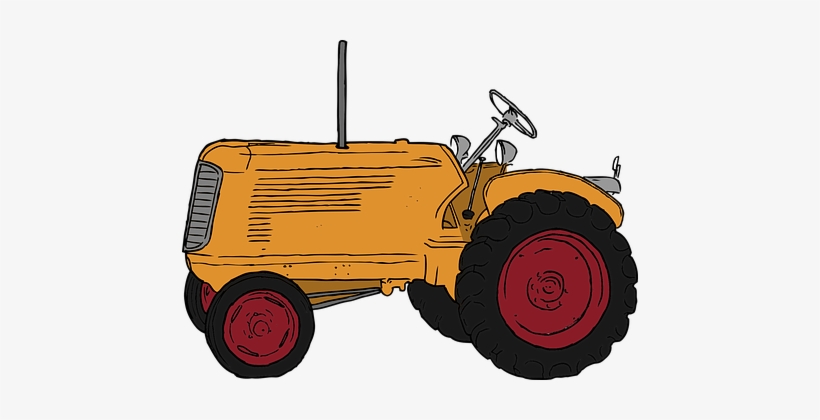
Where is `lights`? The width and height of the screenshot is (820, 420). lights is located at coordinates (497, 148), (453, 139).